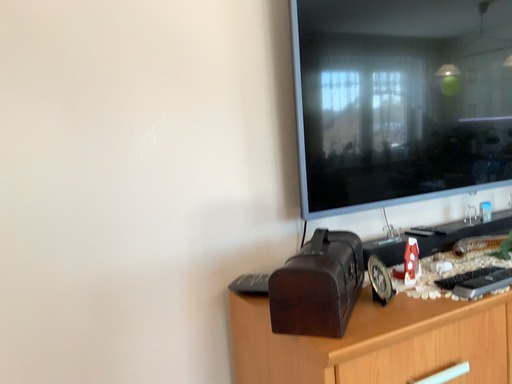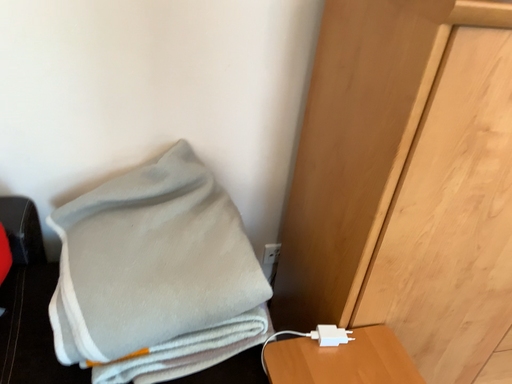
Question: Which way did the camera rotate in the video?

Choices:
 (A) rotated upward
 (B) rotated downward

Answer: (B)